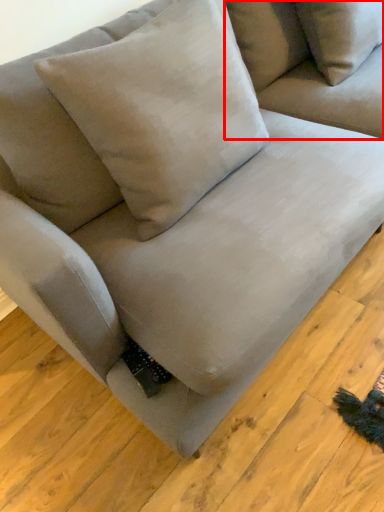
Question: In this image, where is couch (annotated by the red box) located relative to pillow?

Choices:
 (A) left
 (B) right

Answer: (B)